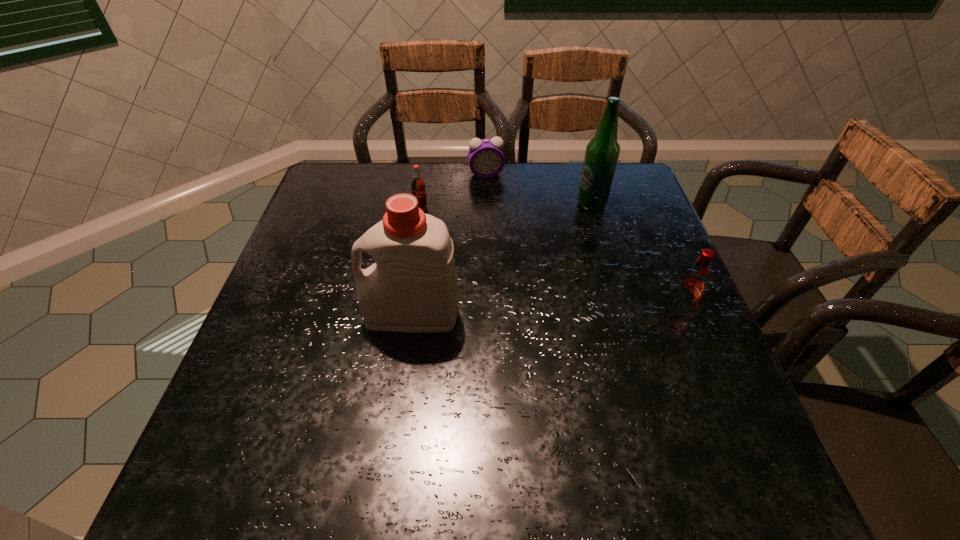
Locate an element on the screen. free space located 0.230m on the label of the second object from right to left is located at coordinates (554, 262).

You are a GUI agent. You are given a task and a screenshot of the screen. Output one action in this format:
    pyautogui.click(x=<x>, y=<y>)
    Task: Click on the vacant space located 0.140m on the label of the second object from right to left
    The width and height of the screenshot is (960, 540).
    Given the screenshot: What is the action you would take?
    pyautogui.click(x=567, y=241)

The image size is (960, 540). Find the location of `vacant space located 0.170m on the label of the second object from right to left`. vacant space located 0.170m on the label of the second object from right to left is located at coordinates (564, 248).

You are a GUI agent. You are given a task and a screenshot of the screen. Output one action in this format:
    pyautogui.click(x=<x>, y=<y>)
    Task: Click on the vacant area situated on the label of the second shortest object
    The image size is (960, 540).
    Given the screenshot: What is the action you would take?
    pyautogui.click(x=444, y=230)

Locate an element on the screen. vacant space located 0.110m on the label of the second shortest object is located at coordinates (456, 237).

The height and width of the screenshot is (540, 960). Identify the location of vacant region located 0.270m on the label of the second shortest object. (503, 266).

What are the coordinates of `vacant space located on the face of the alarm clock` in the screenshot? It's located at (491, 190).

At what (x,y) coordinates should I click in order to perform the action: click on vacant point located 0.210m on the face of the alarm clock. Please return your answer as a coordinate pair (x, y). Image resolution: width=960 pixels, height=540 pixels. Looking at the image, I should click on (499, 224).

The width and height of the screenshot is (960, 540). Identify the location of free space located on the face of the alarm clock. (493, 199).

Locate an element on the screen. This screenshot has width=960, height=540. beer bottle that is at the far edge is located at coordinates (602, 152).